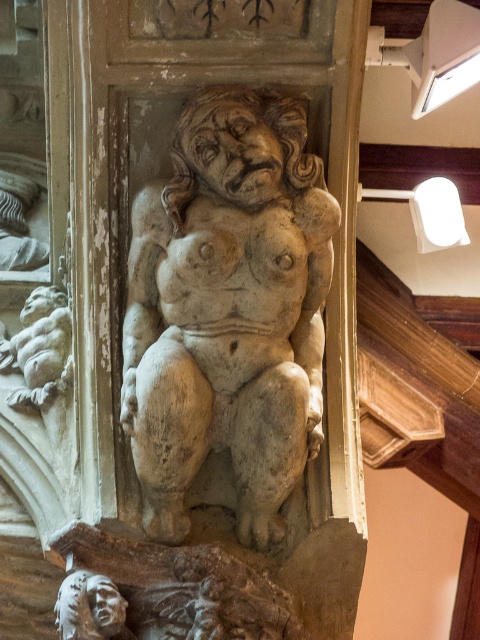
Question: Among these objects, which one is nearest to the camera?

Choices:
 (A) stone statue at center
 (B) smooth stone cherub at lower left

Answer: (A)

Question: Which of the following is the farthest from the observer?

Choices:
 (A) white stone head at lower left
 (B) smooth stone cherub at lower left
 (C) stone statue at center

Answer: (B)

Question: Estimate the real-world distances between objects in this image. Which object is farther from the stone statue at center?

Choices:
 (A) smooth stone cherub at lower left
 (B) white stone head at lower left

Answer: (A)

Question: Does stone statue at center appear over white stone head at lower left?

Choices:
 (A) yes
 (B) no

Answer: (A)

Question: Is smooth stone cherub at lower left behind white stone head at lower left?

Choices:
 (A) yes
 (B) no

Answer: (A)

Question: Is stone statue at center wider than white stone head at lower left?

Choices:
 (A) no
 (B) yes

Answer: (B)